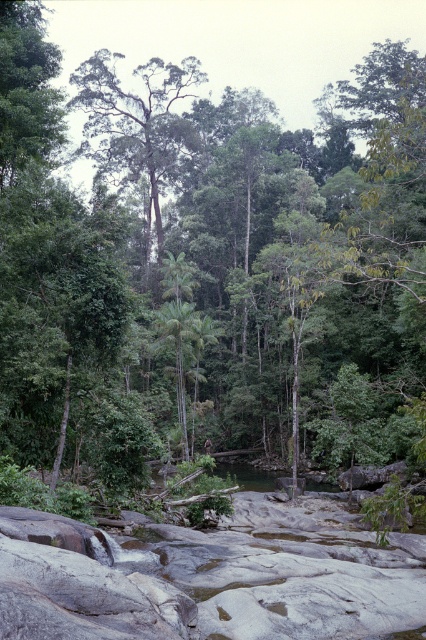
Is green leafy tree at upper center wider than green leafy palm tree at center?

Indeed, green leafy tree at upper center has a greater width compared to green leafy palm tree at center.

Which is behind, point (172, 76) or point (180, 273)?

The point (172, 76) is more distant.

Locate an element on the screen. Image resolution: width=426 pixels, height=640 pixels. green leafy tree at upper center is located at coordinates (137, 125).